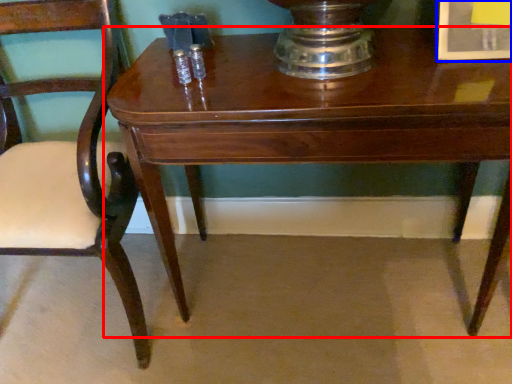
Question: Which of the following is the farthest to the observer, table (highlighted by a red box) or picture frame (highlighted by a blue box)?

Choices:
 (A) table
 (B) picture frame

Answer: (B)